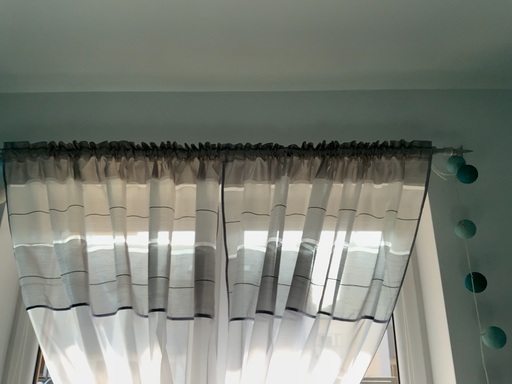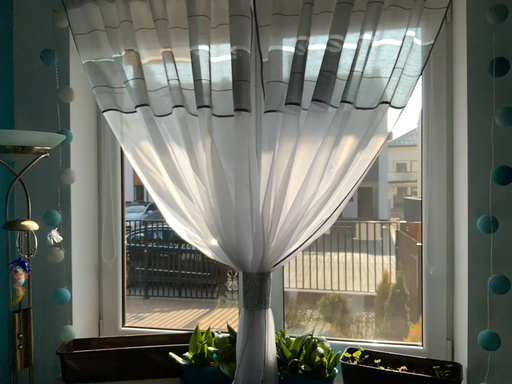
Question: Which way did the camera rotate in the video?

Choices:
 (A) rotated upward
 (B) rotated downward

Answer: (B)